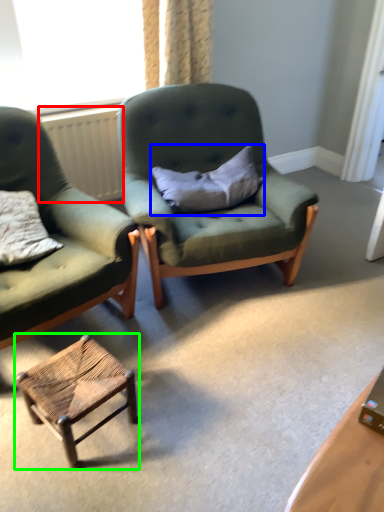
Question: Estimate the real-world distances between objects in this image. Which object is farther from radiator (highlighted by a red box), pillow (highlighted by a blue box) or stool (highlighted by a green box)?

Choices:
 (A) pillow
 (B) stool

Answer: (B)